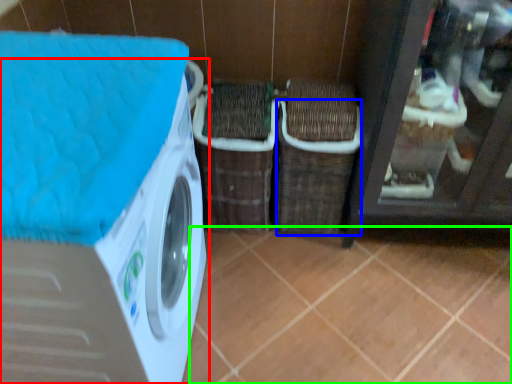
Question: Considering the real-world distances, which object is closest to washing machine (highlighted by a red box)? basket (highlighted by a blue box) or tile (highlighted by a green box).

Choices:
 (A) basket
 (B) tile

Answer: (B)